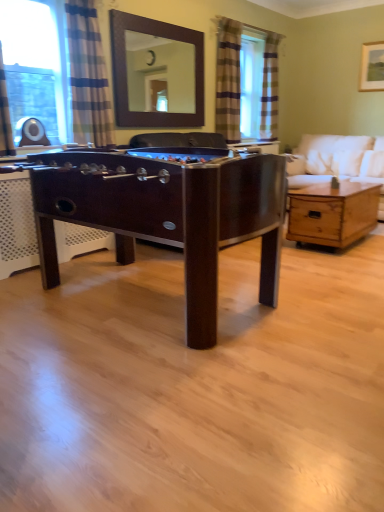
Question: Relative to dark wood foosball table at center, is wooden picture frame at upper right in front or behind?

Choices:
 (A) front
 (B) behind

Answer: (B)

Question: Based on their sizes in the image, would you say wooden picture frame at upper right is bigger or smaller than dark wood foosball table at center?

Choices:
 (A) small
 (B) big

Answer: (A)

Question: Based on their relative distances, which object is nearer to the white fabric couch at right?

Choices:
 (A) blue striped curtain at left
 (B) plaid fabric curtain at upper right, the 2th curtain in the front-to-back sequence
 (C) blue striped curtain at upper left, marked as the first curtain in a left-to-right arrangement
 (D) wooden coffee table at center
 (E) dark wood foosball table at center

Answer: (B)

Question: Which of these objects is positioned farthest from the blue striped curtain at upper left, marked as the first curtain in a left-to-right arrangement?

Choices:
 (A) striped fabric curtain at right, marked as the 3th curtain in a left-to-right arrangement
 (B) blue striped curtain at left
 (C) wooden coffee table at center
 (D) plaid fabric curtain at upper right, which ranks as the 2th curtain in back-to-front order
 (E) brown wooden mirror at upper center

Answer: (E)